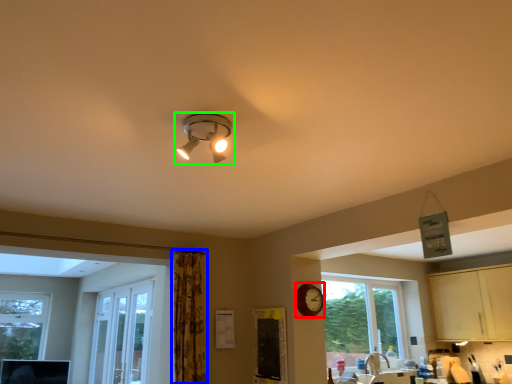
Question: Based on their relative distances, which object is farther from clock (highlighted by a red box)? Choose from curtain (highlighted by a blue box) and lamp (highlighted by a green box).

Choices:
 (A) curtain
 (B) lamp

Answer: (B)